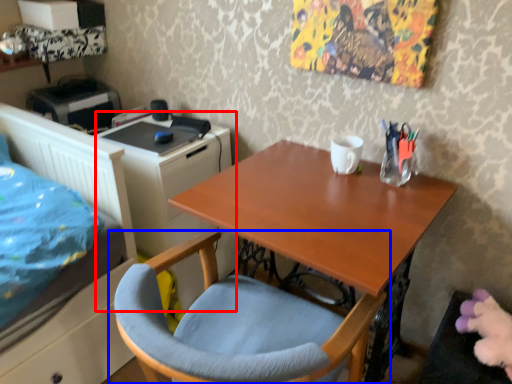
Question: Which point is closer to the camera, file cabinet (highlighted by a red box) or chair (highlighted by a blue box)?

Choices:
 (A) file cabinet
 (B) chair

Answer: (B)